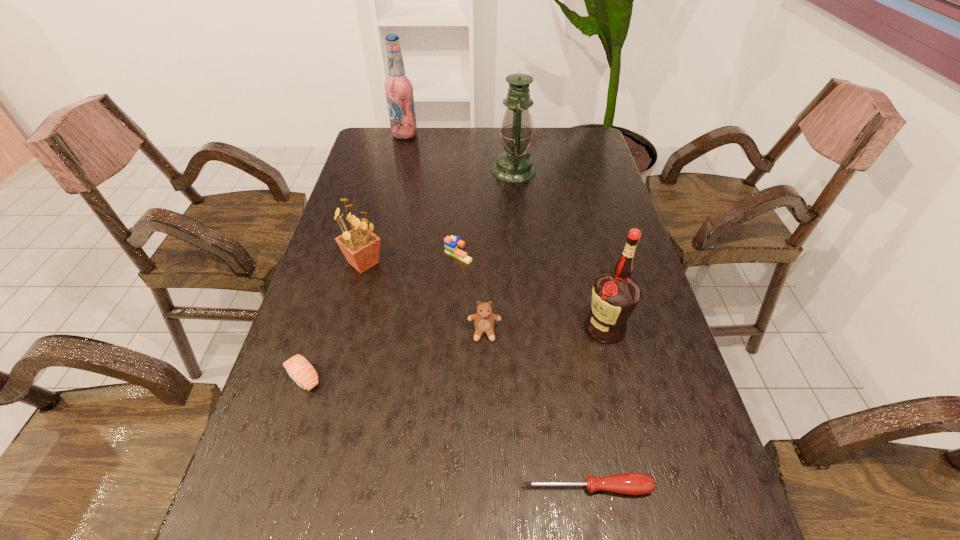
This screenshot has width=960, height=540. I want to click on alcohol that is at the far edge, so click(x=398, y=88).

Find the location of `oil lamp that is at the far edge`. oil lamp that is at the far edge is located at coordinates (514, 165).

Identify the location of alcohol that is at the left edge. (398, 88).

Locate an element on the screen. This screenshot has width=960, height=540. sunflower that is at the left edge is located at coordinates (360, 246).

The width and height of the screenshot is (960, 540). I want to click on sushi present at the left edge, so click(299, 369).

Find the location of `alcohol that is at the right edge`. alcohol that is at the right edge is located at coordinates (615, 294).

Image resolution: width=960 pixels, height=540 pixels. In order to click on screwdriver present at the right edge in this screenshot , I will do `click(628, 483)`.

The height and width of the screenshot is (540, 960). I want to click on object situated at the far left corner, so click(x=398, y=88).

In the image, there is a desktop. At what (x,y) coordinates should I click in order to perform the action: click on vacant space at the far edge. Please return your answer as a coordinate pair (x, y). This screenshot has width=960, height=540. Looking at the image, I should click on (542, 127).

The height and width of the screenshot is (540, 960). I want to click on free space at the left edge, so click(376, 232).